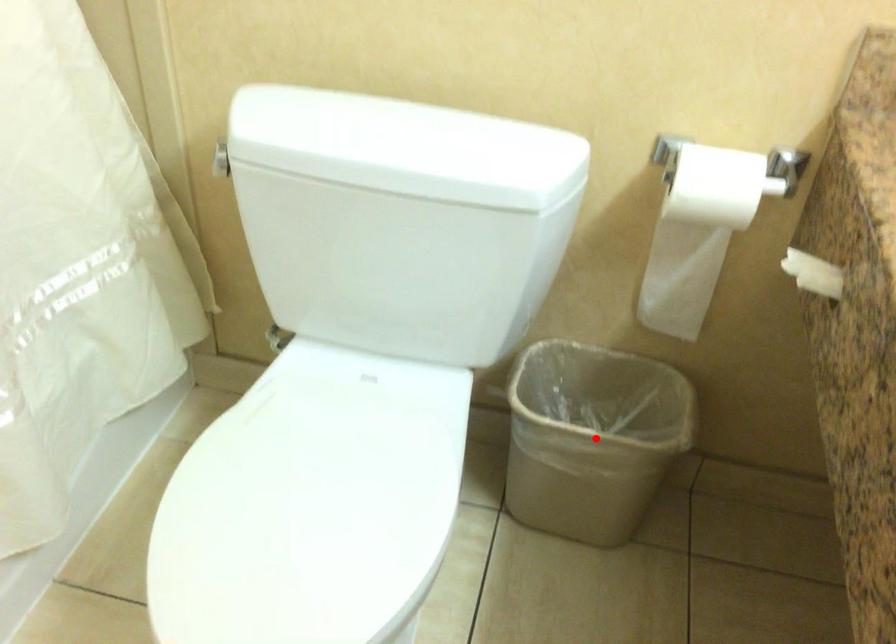
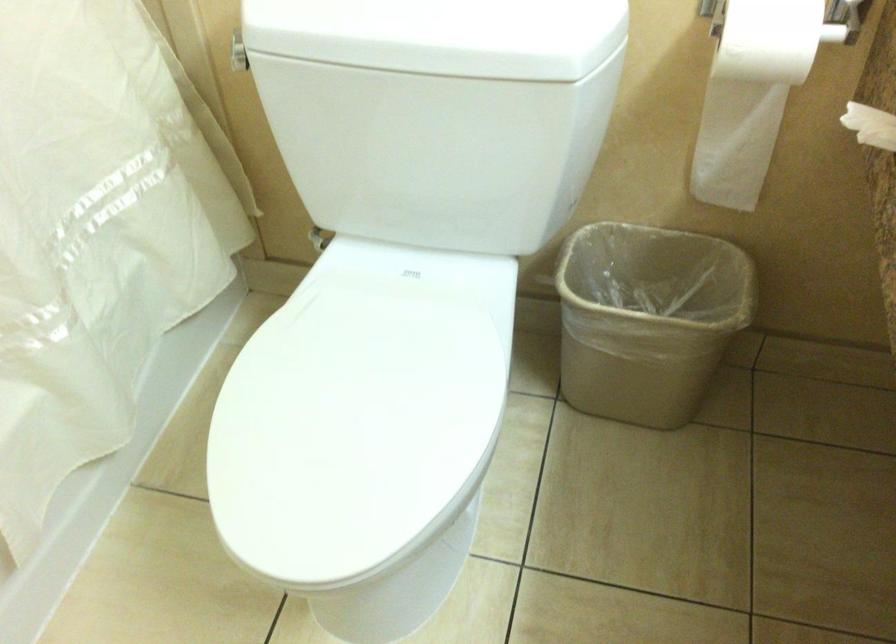
Find the pixel in the second image that matches the highlighted location in the first image.

(647, 319)